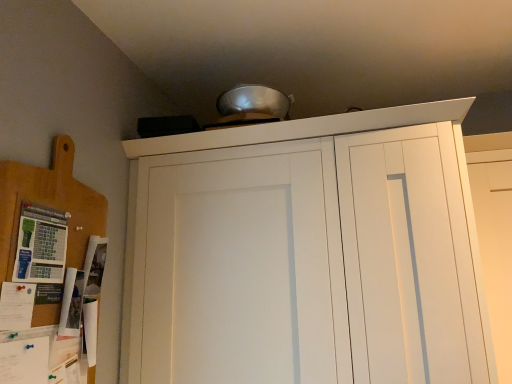
Describe the element at coordinates (496, 251) in the screenshot. I see `white matte door at upper center` at that location.

At what (x,y) coordinates should I click in order to perform the action: click on white matte cupboard at upper center. Please return your answer as a coordinate pair (x, y). This screenshot has width=512, height=384. Looking at the image, I should click on (310, 230).

The width and height of the screenshot is (512, 384). Find the location of `white matte door at upper center`. white matte door at upper center is located at coordinates (496, 251).

Which is behind, point (481, 245) or point (29, 195)?

Positioned behind is point (481, 245).

Is white matte door at upper center next to wooden cutting board at left?

No.

Does white matte door at upper center have a lesser width compared to wooden cutting board at left?

In fact, white matte door at upper center might be wider than wooden cutting board at left.

Could you tell me if white matte door at upper center is turned towards wooden cutting board at left?

No, white matte door at upper center is not aimed at wooden cutting board at left.

Is white matte door at upper center taller than white matte cupboard at upper center?

No.

Considering the positions of objects white matte door at upper center and white matte cupboard at upper center in the image provided, who is more to the right, white matte door at upper center or white matte cupboard at upper center?

Positioned to the right is white matte door at upper center.

From a real-world perspective, which is physically above, white matte door at upper center or white matte cupboard at upper center?

white matte door at upper center is physically above.

Which point is more distant from viewer, (x=507, y=250) or (x=440, y=112)?

The point (x=507, y=250) is more distant.

In terms of width, does wooden cutting board at left look wider or thinner when compared to white matte cupboard at upper center?

Considering their sizes, wooden cutting board at left looks slimmer than white matte cupboard at upper center.

Which object is further away from the camera taking this photo, wooden cutting board at left or white matte cupboard at upper center?

white matte cupboard at upper center is further away from the camera.

How different are the orientations of wooden cutting board at left and white matte cupboard at upper center in degrees?

90 degrees separate the facing orientations of wooden cutting board at left and white matte cupboard at upper center.

Can you confirm if white matte cupboard at upper center is shorter than white matte door at upper center?

In fact, white matte cupboard at upper center may be taller than white matte door at upper center.

Could you tell me if white matte cupboard at upper center is facing white matte door at upper center?

No.

From the image's perspective, relative to white matte door at upper center, is white matte cupboard at upper center above or below?

Clearly, from the image's perspective, white matte cupboard at upper center is below white matte door at upper center.

In the image, is white matte cupboard at upper center positioned in front of or behind white matte door at upper center?

white matte cupboard at upper center is positioned closer to the viewer than white matte door at upper center.

Between wooden cutting board at left and white matte door at upper center, which one is positioned behind?

white matte door at upper center is more distant.

What's the angular difference between wooden cutting board at left and white matte door at upper center's facing directions?

They differ by 90.3 degrees in their facing directions.

From a real-world perspective, which is physically above, wooden cutting board at left or white matte door at upper center?

In real-world perspective, wooden cutting board at left is above.

Is wooden cutting board at left beside white matte door at upper center?

No, wooden cutting board at left is not in contact with white matte door at upper center.

Which is in front, white matte cupboard at upper center or wooden cutting board at left?

Positioned in front is wooden cutting board at left.

Between white matte cupboard at upper center and wooden cutting board at left, which one has more height?

white matte cupboard at upper center is taller.

How different are the orientations of white matte cupboard at upper center and wooden cutting board at left in degrees?

There is a 90-degree angle between the facing directions of white matte cupboard at upper center and wooden cutting board at left.

Which is behind, point (452, 103) or point (49, 316)?

The point (452, 103) is farther.

The width and height of the screenshot is (512, 384). I want to click on cabinetry above the white matte door at upper center (from the image's perspective), so click(49, 203).

You are a GUI agent. You are given a task and a screenshot of the screen. Output one action in this format:
    pyautogui.click(x=<x>, y=<y>)
    Task: Click on the door located on the right of white matte cupboard at upper center
    
    Given the screenshot: What is the action you would take?
    pyautogui.click(x=496, y=251)

Based on their spatial positions, is white matte cupboard at upper center or wooden cutting board at left closer to white matte door at upper center?

white matte cupboard at upper center is positioned closer to the anchor white matte door at upper center.

Estimate the real-world distances between objects in this image. Which object is closer to white matte cupboard at upper center, wooden cutting board at left or white matte door at upper center?

The object closer to white matte cupboard at upper center is white matte door at upper center.

Which object lies nearer to the anchor point wooden cutting board at left, white matte cupboard at upper center or white matte door at upper center?

white matte cupboard at upper center lies closer to wooden cutting board at left than the other object.

When comparing their distances from white matte door at upper center, does wooden cutting board at left or white matte cupboard at upper center seem closer?

Based on the image, white matte cupboard at upper center appears to be nearer to white matte door at upper center.

Estimate the real-world distances between objects in this image. Which object is further from white matte cupboard at upper center, white matte door at upper center or wooden cutting board at left?

wooden cutting board at left.

Looking at the image, which one is located further to wooden cutting board at left, white matte door at upper center or white matte cupboard at upper center?

The object further to wooden cutting board at left is white matte door at upper center.

Where is `cupboard between wooden cutting board at left and white matte door at upper center in the horizontal direction`? The height and width of the screenshot is (384, 512). cupboard between wooden cutting board at left and white matte door at upper center in the horizontal direction is located at coordinates (310, 230).